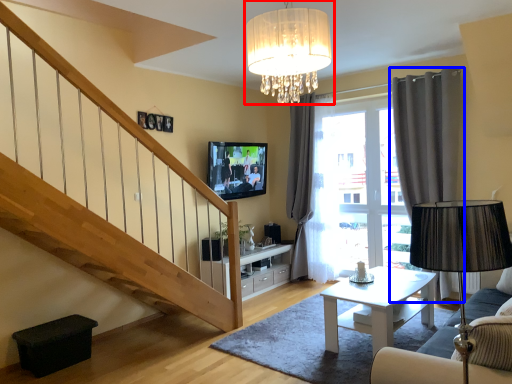
Question: Which of the following is the closest to the observer, lamp (highlighted by a red box) or curtain (highlighted by a blue box)?

Choices:
 (A) lamp
 (B) curtain

Answer: (A)